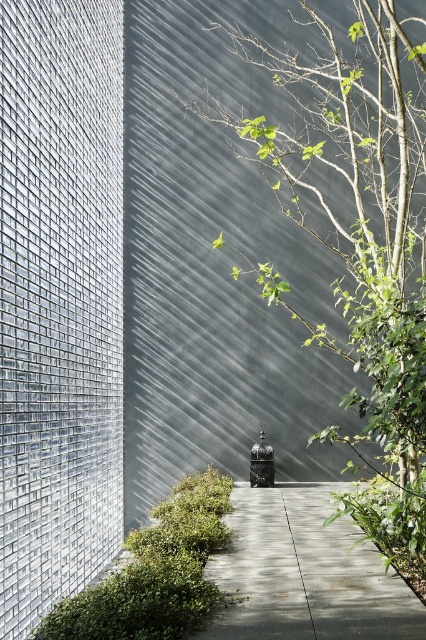
Question: Is green leafy tree at center positioned at the back of green leafy hedge at lower left?

Choices:
 (A) yes
 (B) no

Answer: (A)

Question: Is gray concrete path at center to the left of green leafy hedge at lower left from the viewer's perspective?

Choices:
 (A) no
 (B) yes

Answer: (A)

Question: Where is gray concrete path at center located in relation to green leafy hedge at lower left in the image?

Choices:
 (A) above
 (B) below

Answer: (A)

Question: Among these objects, which one is farthest from the camera?

Choices:
 (A) green leafy tree at center
 (B) gray concrete path at center
 (C) green leafy hedge at lower left

Answer: (A)

Question: Among these points, which one is nearest to the camera?

Choices:
 (A) [293, 164]
 (B) [112, 627]

Answer: (B)

Question: Which point is closer to the camera taking this photo?

Choices:
 (A) (368, 620)
 (B) (344, 100)

Answer: (A)